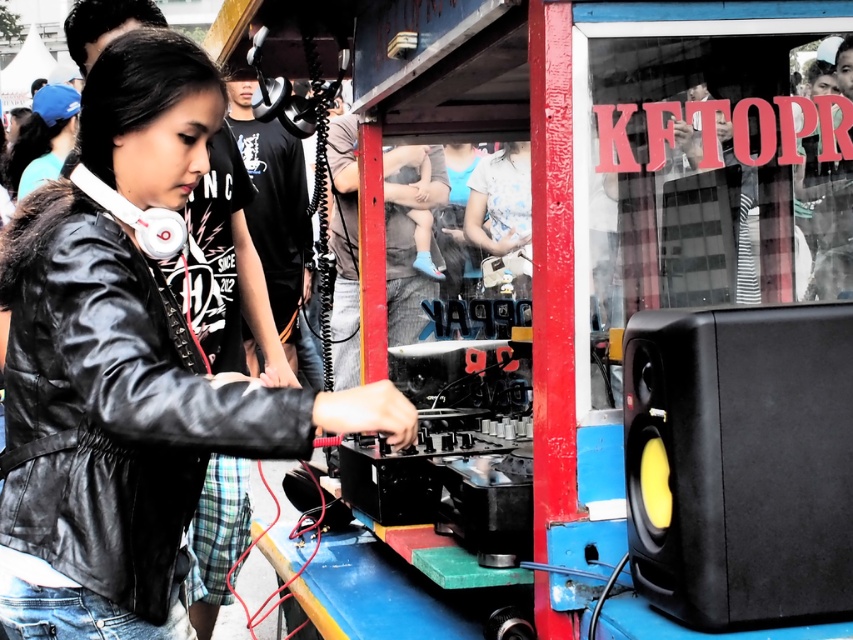
Question: Which object is farther from the camera taking this photo?

Choices:
 (A) black matte speaker at lower right
 (B) black leather jacket at center

Answer: (A)

Question: Which point is farther to the camera?

Choices:
 (A) (651, 506)
 (B) (123, 624)

Answer: (B)

Question: Which point is closer to the camera?

Choices:
 (A) (820, 545)
 (B) (82, 317)

Answer: (B)

Question: Does black leather jacket at center have a smaller size compared to black matte speaker at lower right?

Choices:
 (A) yes
 (B) no

Answer: (B)

Question: Is black leather jacket at center above black matte speaker at lower right?

Choices:
 (A) no
 (B) yes

Answer: (B)

Question: Is black leather jacket at center positioned at the back of black matte speaker at lower right?

Choices:
 (A) yes
 (B) no

Answer: (B)